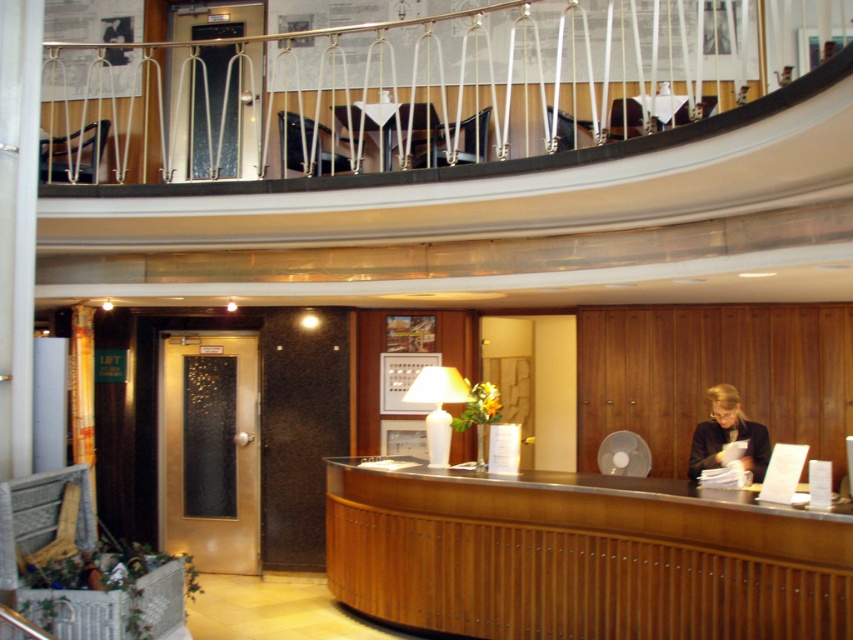
You are a guest entering the hotel lobby and need to check in. You see the wooden reception desk at center and the black fabric jacket at center. Which object is taller?

The wooden reception desk at center is taller than the black fabric jacket at center.